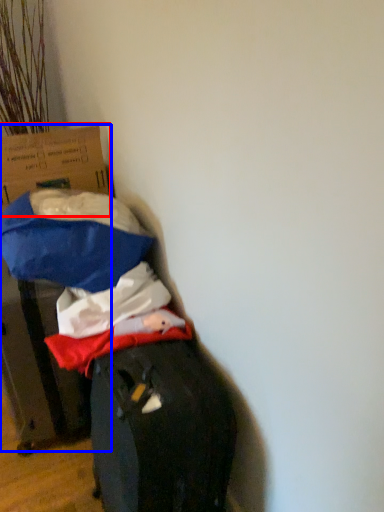
Question: Which point is further to the camera, cardboard box (highlighted by a red box) or cardboard box (highlighted by a blue box)?

Choices:
 (A) cardboard box
 (B) cardboard box

Answer: (A)